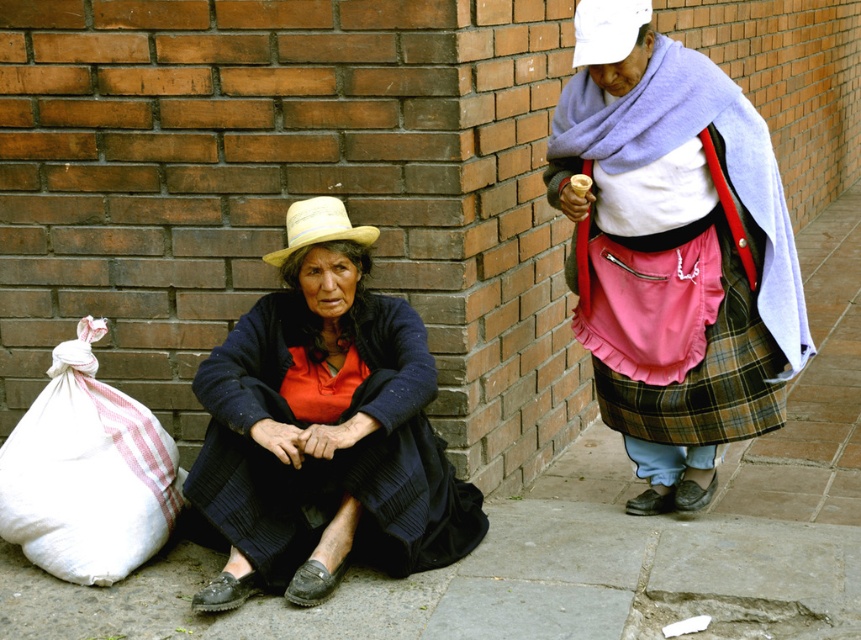
You are a delivery person who needs to place a package on the gray concrete pavement at lower center. However, there is a knitted dark blue sweater at lower left in the way. Can you move the sweater to access the pavement?

The gray concrete pavement at lower center is in front of the knitted dark blue sweater at lower left, meaning the sweater is blocking access to the pavement. You will need to move the sweater to place the package there.

You are a delivery person who needs to place a small package on the gray concrete pavement at lower center. However, there is a knitted dark blue sweater at lower left in the way. Based on their positions, can you move the sweater to the left to make space for the package?

The gray concrete pavement at lower center is positioned on the right side of the knitted dark blue sweater at lower left. To move the sweater to the left, you would need to shift it away from the pavement, which would free up space on the right side of the sweater for the package.